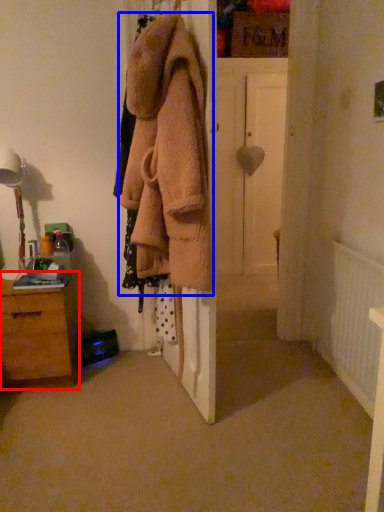
Question: Among these objects, which one is farthest to the camera, chest of drawers (highlighted by a red box) or clothing (highlighted by a blue box)?

Choices:
 (A) chest of drawers
 (B) clothing

Answer: (A)